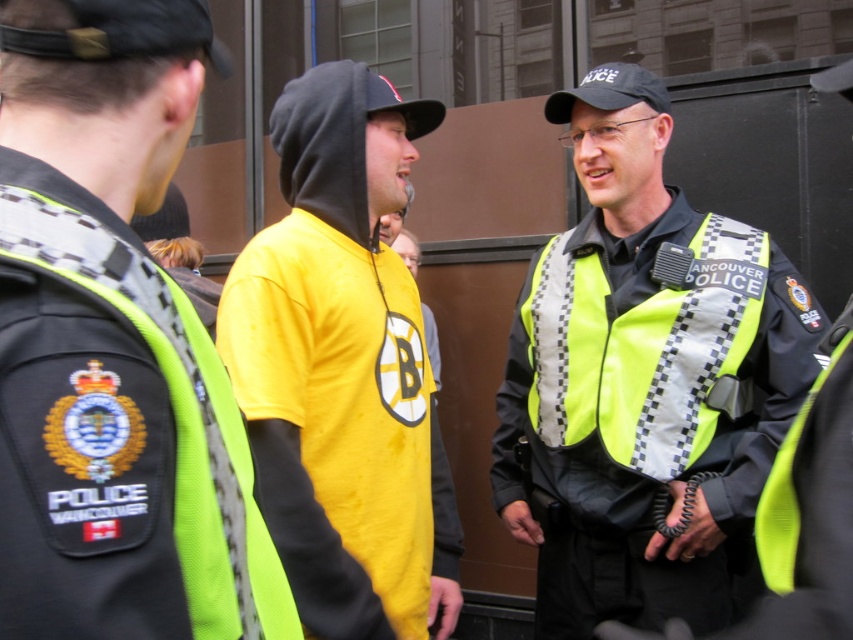
You are a safety inspector assessing the visibility of vests in a crowd. You notice two vests at the center of the scene. The first is labeled as the reflective yellow vest at center, and the second is the neon yellow reflective vest at center. Which vest has a taller design?

The reflective yellow vest at center has a greater height compared to the neon yellow reflective vest at center, so the reflective yellow vest at center is taller.

You are a safety inspector checking the visibility of vests in an emergency drill. You notice two vests at the center of the scene. The first is labeled as the reflective yellow vest at center, and the second is the neon yellow reflective vest at center. According to safety regulations, wider vests are more visible. Which vest should you recommend for better visibility?

The reflective yellow vest at center has a greater width than the neon yellow reflective vest at center. Since wider vests are more visible according to safety regulations, the reflective yellow vest at center should be recommended for better visibility.

You are a fashion designer observing the scene. You need to create a new design that combines elements from both the yellow fabric shirt at center and the neon yellow reflective vest at center. Which object should you use as the base for the size of the garment to ensure it fits properly?

The yellow fabric shirt at center is bigger than the neon yellow reflective vest at center, so you should use the yellow fabric shirt at center as the base for the size of the garment to ensure proper fit.